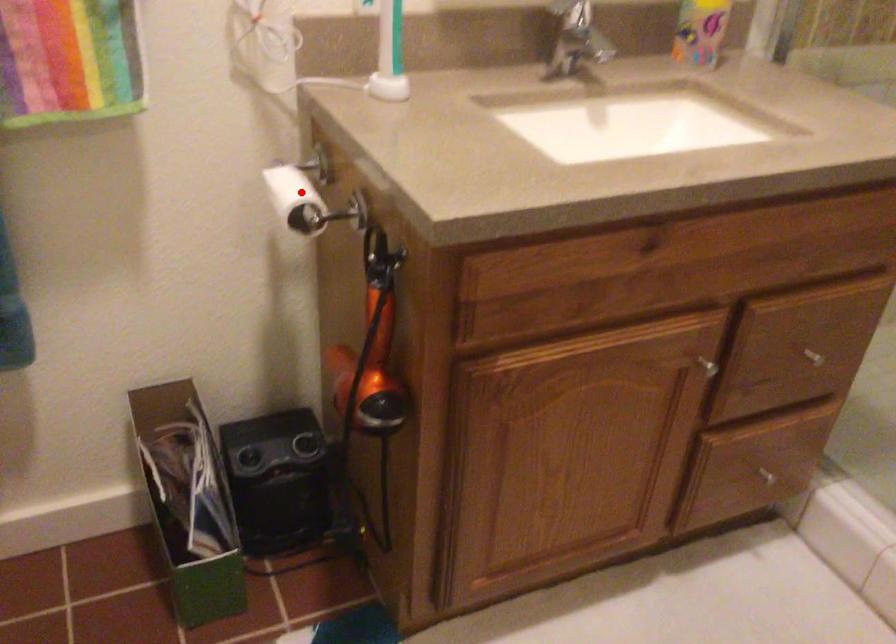
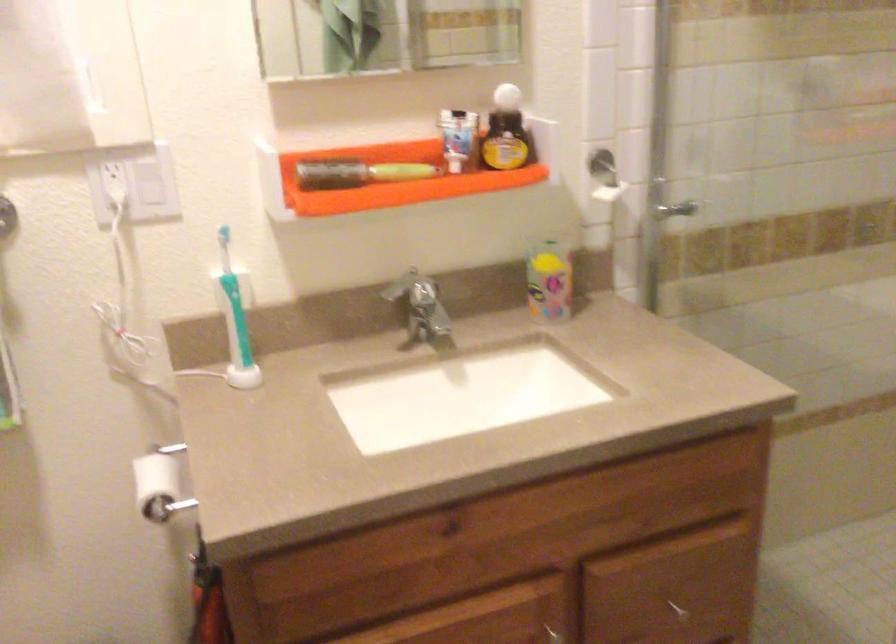
Find the pixel in the second image that matches the highlighted location in the first image.

(159, 484)